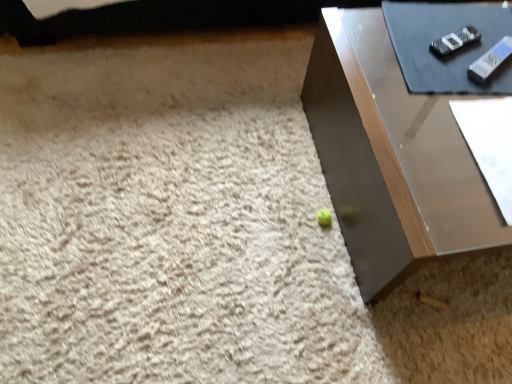
Measure the distance between point [345,105] and camera.

They are 1.17 meters apart.

The height and width of the screenshot is (384, 512). What do you see at coordinates (391, 156) in the screenshot?
I see `shiny brown table at lower right` at bounding box center [391, 156].

Find the location of `shiny brown table at lower right`. shiny brown table at lower right is located at coordinates (391, 156).

What is the approximate width of shiny brown table at lower right?

It is 31.86 inches.

At what (x,y) coordinates should I click in order to perform the action: click on shiny brown table at lower right. Please return your answer as a coordinate pair (x, y). Looking at the image, I should click on (391, 156).